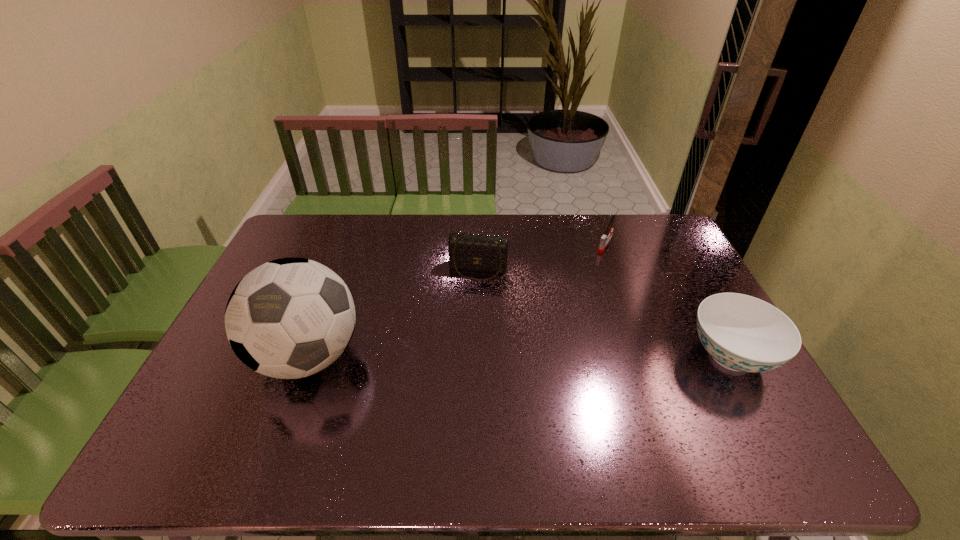
The width and height of the screenshot is (960, 540). What are the coordinates of `object that is at the near right corner` in the screenshot? It's located at (742, 333).

The height and width of the screenshot is (540, 960). In the image, there is a desktop. Find the location of `vacant space at the far edge`. vacant space at the far edge is located at coordinates (577, 219).

The height and width of the screenshot is (540, 960). In order to click on vacant region at the near edge of the desktop in this screenshot , I will do `click(397, 419)`.

I want to click on free location at the right edge of the desktop, so click(663, 303).

Locate an element on the screen. This screenshot has height=540, width=960. free space at the far left corner of the desktop is located at coordinates (328, 228).

Identify the location of free space at the far right corner of the desktop. The width and height of the screenshot is (960, 540). (658, 236).

At what (x,y) coordinates should I click in order to perform the action: click on free space at the near right corner of the desktop. Please return your answer as a coordinate pair (x, y). This screenshot has height=540, width=960. Looking at the image, I should click on (758, 403).

The height and width of the screenshot is (540, 960). What are the coordinates of `vacant space that's between the third object from right to left and the chinaware` in the screenshot? It's located at (605, 313).

Where is `vacant space that's between the third object from left to right and the rightmost object`? The width and height of the screenshot is (960, 540). vacant space that's between the third object from left to right and the rightmost object is located at coordinates (668, 300).

Where is `unoccupied position between the chinaware and the farthest object`? unoccupied position between the chinaware and the farthest object is located at coordinates (668, 300).